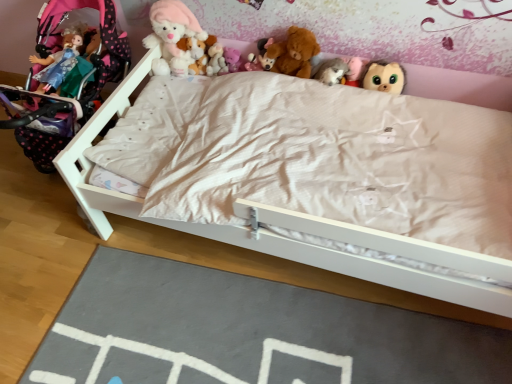
Where is `pink polka dot baby carriage at left`? Image resolution: width=512 pixels, height=384 pixels. pink polka dot baby carriage at left is located at coordinates (85, 49).

This screenshot has width=512, height=384. Describe the element at coordinates (206, 56) in the screenshot. I see `fluffy plush toys at center, which is the second toy from left to right` at that location.

What do you see at coordinates (353, 71) in the screenshot? I see `fluffy pink teddy bear at upper center, which is counted as the 7th toy, starting from the left` at bounding box center [353, 71].

The image size is (512, 384). I want to click on fluffy white teddy bear at upper center, marked as the 8th toy in a right-to-left arrangement, so click(172, 36).

I want to click on fluffy plush toys at upper center, so click(x=291, y=25).

This screenshot has width=512, height=384. Identify the location of pink polka dot baby carriage at left. (85, 49).

In the scene shown: Is slate at lower center turned away from fluffy plush toys at upper center?

No, fluffy plush toys at upper center is not at the back of slate at lower center.

Considering the sizes of objects slate at lower center and fluffy plush toys at upper center in the image provided, who is smaller, slate at lower center or fluffy plush toys at upper center?

fluffy plush toys at upper center is smaller.

Is slate at lower center closer to camera compared to fluffy plush toys at upper center?

That is True.

From the image's perspective, which one is positioned higher, pink polka dot baby carriage at left or fluffy brown plush at upper center, the eighth toy in the left-to-right sequence?

pink polka dot baby carriage at left appears higher in the image.

Considering the points (50, 163) and (377, 77), which point is in front, point (50, 163) or point (377, 77)?

The point (377, 77) is closer.

Which is in front, pink polka dot baby carriage at left or fluffy brown plush at upper center, the first toy when ordered from right to left?

fluffy brown plush at upper center, the first toy when ordered from right to left, is more forward.

Can you confirm if pink polka dot baby carriage at left is smaller than fluffy brown plush at upper center, the first toy when ordered from right to left?

No, pink polka dot baby carriage at left is not smaller than fluffy brown plush at upper center, the first toy when ordered from right to left.

Who is bigger, matte pink teddy bear at upper center, the third toy positioned from the left, or fluffy plush toys at upper center?

With larger size is fluffy plush toys at upper center.

In order to click on collection above the matte pink teddy bear at upper center, which is the sixth toy from right to left (from a real-world perspective) in this screenshot , I will do `click(291, 25)`.

Which is more to the right, matte pink teddy bear at upper center, the third toy positioned from the left, or fluffy plush toys at upper center?

fluffy plush toys at upper center is more to the right.

Which object is thinner, matte pink teddy bear at upper center, which is the sixth toy from right to left, or fluffy plush toys at upper center?

With smaller width is fluffy plush toys at upper center.

Does point (384, 90) appear closer or farther from the camera than point (196, 293)?

Clearly, point (384, 90) is more distant from the camera than point (196, 293).

Is fluffy brown plush at upper center, the first toy when ordered from right to left, next to slate at lower center?

No, fluffy brown plush at upper center, the first toy when ordered from right to left, is not touching slate at lower center.

Which is more to the left, fluffy brown plush at upper center, the eighth toy in the left-to-right sequence, or slate at lower center?

Positioned to the left is slate at lower center.

Between fluffy plush toys at upper center and fluffy brown plush at upper center, the first toy when ordered from right to left, which one has less height?

With less height is fluffy brown plush at upper center, the first toy when ordered from right to left.

From a real-world perspective, is fluffy plush toys at upper center below fluffy brown plush at upper center, the first toy when ordered from right to left?

No, from a real-world perspective, fluffy plush toys at upper center is not below fluffy brown plush at upper center, the first toy when ordered from right to left.

Considering the sizes of objects fluffy plush toys at upper center and fluffy brown plush at upper center, the first toy when ordered from right to left, in the image provided, who is smaller, fluffy plush toys at upper center or fluffy brown plush at upper center, the first toy when ordered from right to left,?

With smaller size is fluffy brown plush at upper center, the first toy when ordered from right to left.

The height and width of the screenshot is (384, 512). I want to click on the 8th toy below the fluffy plush toys at upper center (from the image's perspective), so click(384, 77).

Measure the distance from fluffy brown teddy bear at upper center, which ranks as the 5th toy in right-to-left order, to fuzzy gray cat at upper center, which is the third toy in right-to-left order.

fluffy brown teddy bear at upper center, which ranks as the 5th toy in right-to-left order, is 9.57 inches from fuzzy gray cat at upper center, which is the third toy in right-to-left order.

In the image, is fluffy brown teddy bear at upper center, which ranks as the 5th toy in right-to-left order, positioned in front of or behind fuzzy gray cat at upper center, which is the third toy in right-to-left order?

Clearly, fluffy brown teddy bear at upper center, which ranks as the 5th toy in right-to-left order, is behind fuzzy gray cat at upper center, which is the third toy in right-to-left order.

Is fluffy brown teddy bear at upper center, which ranks as the 5th toy in right-to-left order, completely or partially outside of fuzzy gray cat at upper center, which is the third toy in right-to-left order?

Yes, fluffy brown teddy bear at upper center, which ranks as the 5th toy in right-to-left order, is located beyond the bounds of fuzzy gray cat at upper center, which is the third toy in right-to-left order.

Considering the positions of objects fluffy brown teddy bear at upper center, arranged as the fourth toy when viewed from the left, and fuzzy gray cat at upper center, acting as the 6th toy starting from the left, in the image provided, who is more to the right, fluffy brown teddy bear at upper center, arranged as the fourth toy when viewed from the left, or fuzzy gray cat at upper center, acting as the 6th toy starting from the left,?

fuzzy gray cat at upper center, acting as the 6th toy starting from the left.

How different are the orientations of brown plush bear at upper center, which is the 5th toy from left to right, and fluffy plush toys at upper center in degrees?

0.571 degrees separate the facing orientations of brown plush bear at upper center, which is the 5th toy from left to right, and fluffy plush toys at upper center.

At what (x,y) coordinates should I click in order to perform the action: click on collection above the brown plush bear at upper center, which is the 5th toy from left to right (from a real-world perspective). Please return your answer as a coordinate pair (x, y). The image size is (512, 384). Looking at the image, I should click on point(291,25).

Is brown plush bear at upper center, arranged as the fourth toy when viewed from the right, in front of or behind fluffy plush toys at upper center in the image?

Clearly, brown plush bear at upper center, arranged as the fourth toy when viewed from the right, is behind fluffy plush toys at upper center.

From the image's perspective, is brown plush bear at upper center, which is the 5th toy from left to right, beneath fluffy plush toys at upper center?

Yes.

Image resolution: width=512 pixels, height=384 pixels. What are the coordinates of `slate on the left of fluffy plush toys at upper center` in the screenshot? It's located at (248, 332).

Image resolution: width=512 pixels, height=384 pixels. I want to click on baby carriage behind the fluffy brown plush at upper center, the eighth toy in the left-to-right sequence, so click(x=85, y=49).

Based on their spatial positions, is fluffy brown teddy bear at upper center, which ranks as the 5th toy in right-to-left order, or slate at lower center closer to fluffy white teddy bear at upper center, marked as the 8th toy in a right-to-left arrangement?

fluffy brown teddy bear at upper center, which ranks as the 5th toy in right-to-left order, is closer to fluffy white teddy bear at upper center, marked as the 8th toy in a right-to-left arrangement.

From the image, which object appears to be nearer to fluffy white teddy bear at upper center, placed as the first toy when sorted from left to right, pink polka dot baby carriage at left or brown plush bear at upper center, arranged as the fourth toy when viewed from the right?

Among the two, pink polka dot baby carriage at left is located nearer to fluffy white teddy bear at upper center, placed as the first toy when sorted from left to right.

Considering their positions, is fluffy pink teddy bear at upper center, which is counted as the 7th toy, starting from the left, positioned closer to matte pink teddy bear at upper center, which is the sixth toy from right to left, than fluffy brown teddy bear at upper center, which ranks as the 5th toy in right-to-left order?

fluffy brown teddy bear at upper center, which ranks as the 5th toy in right-to-left order, is positioned closer to the anchor matte pink teddy bear at upper center, which is the sixth toy from right to left.

Based on their spatial positions, is fluffy plush toys at upper center or fluffy brown teddy bear at upper center, arranged as the fourth toy when viewed from the left, closer to fluffy white teddy bear at upper center, placed as the first toy when sorted from left to right?

Among the two, fluffy plush toys at upper center is located nearer to fluffy white teddy bear at upper center, placed as the first toy when sorted from left to right.

From the image, which object appears to be farther from fluffy white teddy bear at upper center, marked as the 8th toy in a right-to-left arrangement, fluffy pink teddy bear at upper center, which is counted as the 7th toy, starting from the left, or fluffy brown plush at upper center, the eighth toy in the left-to-right sequence?

fluffy brown plush at upper center, the eighth toy in the left-to-right sequence, is further to fluffy white teddy bear at upper center, marked as the 8th toy in a right-to-left arrangement.

Considering their positions, is brown plush bear at upper center, which is the 5th toy from left to right, positioned closer to fluffy pink teddy bear at upper center, positioned as the second toy in right-to-left order, than matte pink teddy bear at upper center, the third toy positioned from the left?

brown plush bear at upper center, which is the 5th toy from left to right, is closer to fluffy pink teddy bear at upper center, positioned as the second toy in right-to-left order.

Based on their spatial positions, is fluffy plush toys at center, which is counted as the seventh toy, starting from the right, or brown plush bear at upper center, which is the 5th toy from left to right, further from fluffy plush toys at upper center?

Among the two, fluffy plush toys at center, which is counted as the seventh toy, starting from the right, is located further to fluffy plush toys at upper center.

Looking at the image, which one is located further to fluffy brown plush at upper center, the eighth toy in the left-to-right sequence, pink polka dot baby carriage at left or fluffy plush toys at upper center?

Based on the image, pink polka dot baby carriage at left appears to be further to fluffy brown plush at upper center, the eighth toy in the left-to-right sequence.

Locate an element on the screen. This screenshot has height=384, width=512. baby carriage that lies between fluffy plush toys at center, which is the second toy from left to right, and slate at lower center from top to bottom is located at coordinates (85, 49).

You are a GUI agent. You are given a task and a screenshot of the screen. Output one action in this format:
    pyautogui.click(x=<x>, y=<y>)
    Task: Click on the baby carriage between matte pink teddy bear at upper center, which is the sixth toy from right to left, and slate at lower center in the up-down direction
    This screenshot has width=512, height=384.
    Given the screenshot: What is the action you would take?
    pyautogui.click(x=85, y=49)

Where is `toy between pink polka dot baby carriage at left and fluffy plush toys at center, which is the second toy from left to right, from left to right`? The image size is (512, 384). toy between pink polka dot baby carriage at left and fluffy plush toys at center, which is the second toy from left to right, from left to right is located at coordinates (172, 36).

Locate an element on the screen. baby carriage between fluffy brown teddy bear at upper center, arranged as the fourth toy when viewed from the left, and slate at lower center in the up-down direction is located at coordinates (85, 49).